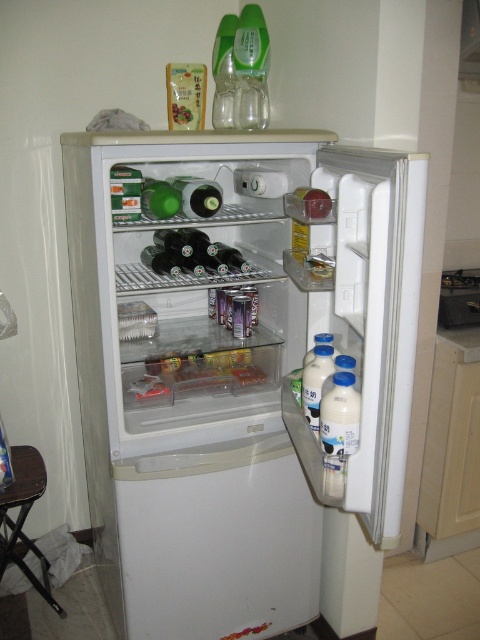
You are a delivery person who needs to place a new stool in the refrigerator. The stool must be placed at the coordinates specified by point (24, 516). Where exactly should you place the stool inside the refrigerator?

The point (24, 516) corresponds to the brown wood stool at lower left, so you should place the stool at the lower left area inside the refrigerator.

You are standing in a room and want to place a new appliance. Where should you place it so that it aligns with the white plastic fridge at center?

The white plastic fridge at center is located at position point (237, 365). To align with it, place the new appliance at the same coordinates.